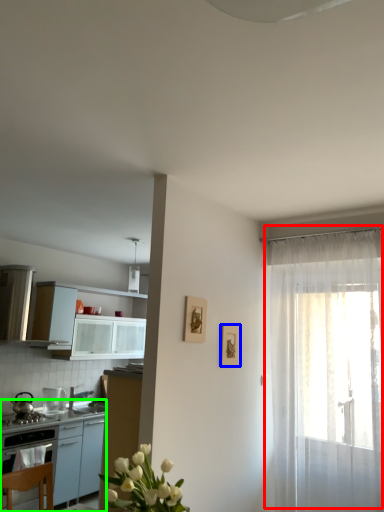
Question: Which object is the closest to the curtain (highlighted by a red box)? Choose among these: picture frame (highlighted by a blue box) or table (highlighted by a green box).

Choices:
 (A) picture frame
 (B) table

Answer: (A)